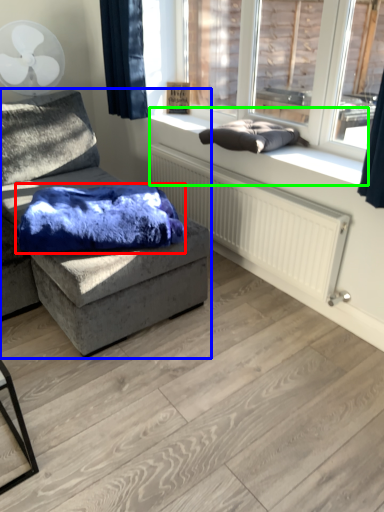
Question: Considering the real-world distances, which object is farthest from material (highlighted by a red box)? studio couch (highlighted by a blue box) or window sill (highlighted by a green box)?

Choices:
 (A) studio couch
 (B) window sill

Answer: (B)